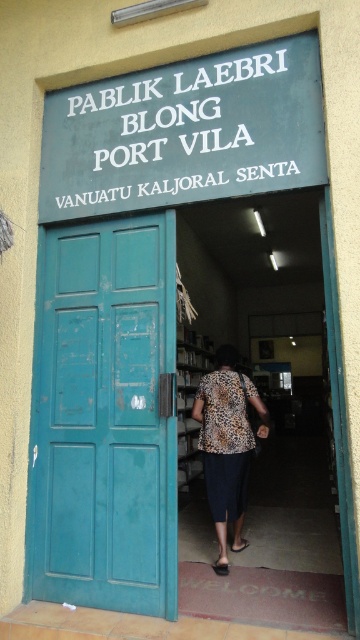
Who is more distant from viewer, (165,380) or (198,461)?

The point (198,461) is more distant.

Does teal matte door at left have a greater width compared to matte wood bookshelf at center?

Yes.

Which is in front, point (33, 500) or point (195, 336)?

Point (33, 500) is more forward.

What are the coordinates of `teal matte door at left` in the screenshot? It's located at (105, 417).

Can you confirm if green painted signboard at upper center is shorter than leopard print blouse at center?

Correct, green painted signboard at upper center is not as tall as leopard print blouse at center.

Which of these two, green painted signboard at upper center or leopard print blouse at center, stands taller?

leopard print blouse at center is taller.

Which is behind, point (41, 173) or point (218, 353)?

Positioned behind is point (218, 353).

Where is `green painted signboard at upper center`? Image resolution: width=360 pixels, height=640 pixels. green painted signboard at upper center is located at coordinates (186, 132).

How much distance is there between teal matte door at left and green painted signboard at upper center?

The distance of teal matte door at left from green painted signboard at upper center is 34.33 inches.

In the scene shown: Between teal matte door at left and green painted signboard at upper center, which one appears on the left side from the viewer's perspective?

teal matte door at left is more to the left.

Locate an element on the screen. The width and height of the screenshot is (360, 640). teal matte door at left is located at coordinates (105, 417).